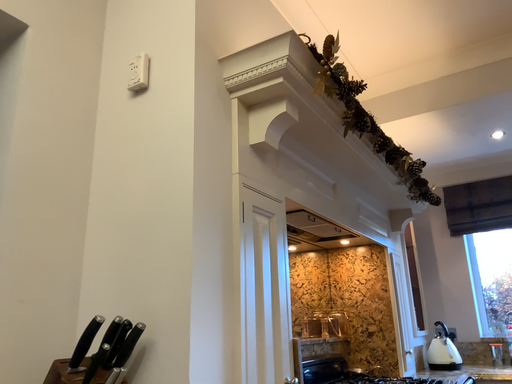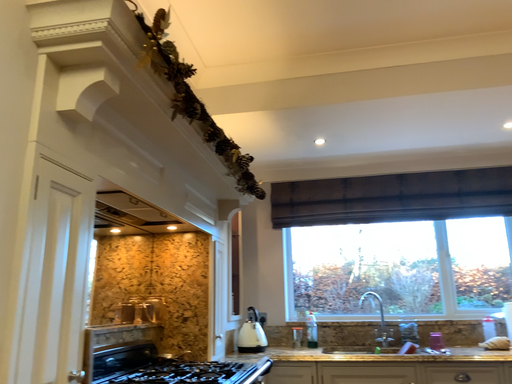
Question: Which way did the camera rotate in the video?

Choices:
 (A) rotated left
 (B) rotated right

Answer: (B)